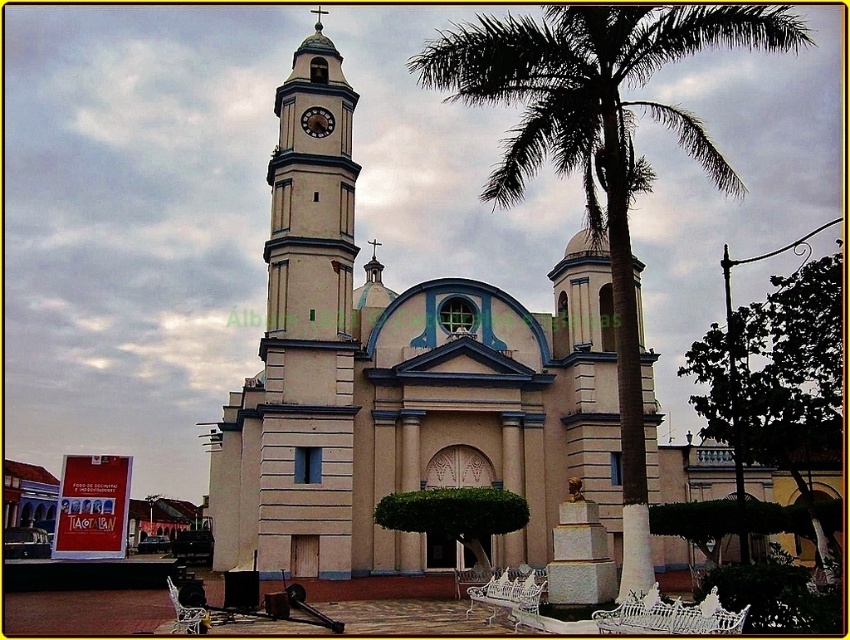
You are standing in front of the church and want to take a photo of the clock tower. There is a green leafy palm tree at center blocking your view. Where should you move to get an unobstructed view of the clock tower?

Move to the left or right of the green leafy palm tree at center to get an unobstructed view of the clock tower since the tree is blocking the view from the center.

You are standing in front of the church and want to know which clock is higher. Which one is higher between the white smooth clock tower at upper left and the wooden clock at center?

The white smooth clock tower at upper left is positioned over the wooden clock at center, so it is higher.